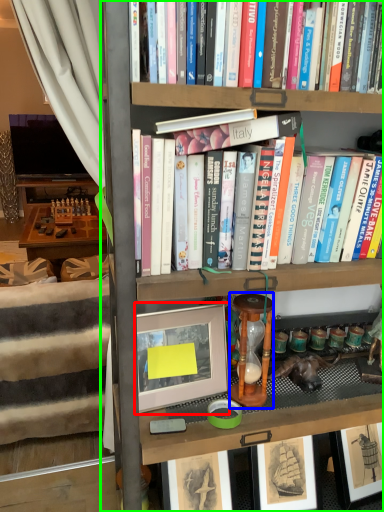
Question: Considering the real-world distances, which object is closest to picture frame (highlighted by a red box)? stool (highlighted by a blue box) or bookcase (highlighted by a green box).

Choices:
 (A) stool
 (B) bookcase

Answer: (A)